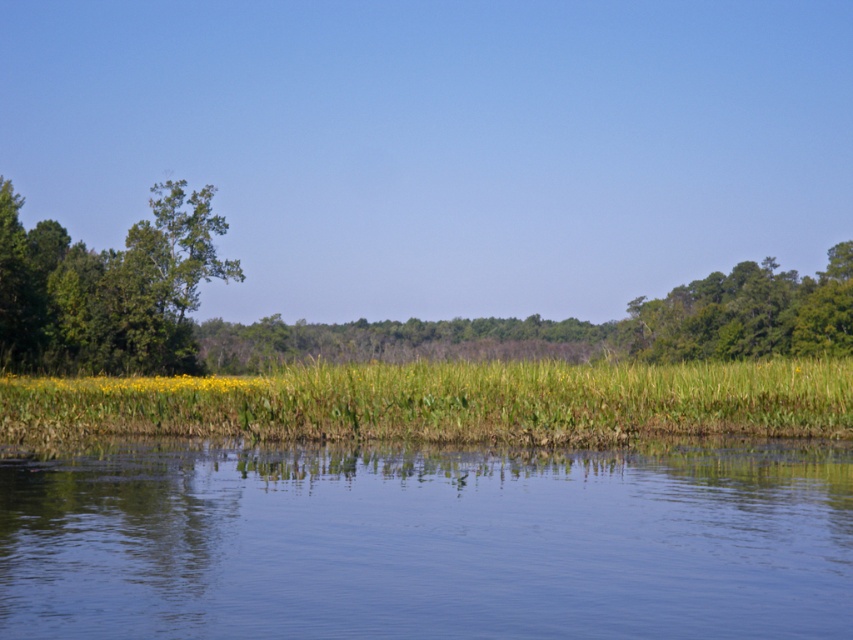
You are standing at the edge of the water and want to walk to the green leafy tree at left. Which direction should you move relative to the green grass at center?

→ The green grass at center is to the right of the green leafy tree at left, so you should move to the left relative to the green grass at center to reach the green leafy tree at left.

You are standing on the bank of the lake and see the transparent water at center and the green leafy tree at left. Which object is closer to the water surface?

The transparent water at center is located below the green leafy tree at left, so the transparent water at center is closer to the water surface.